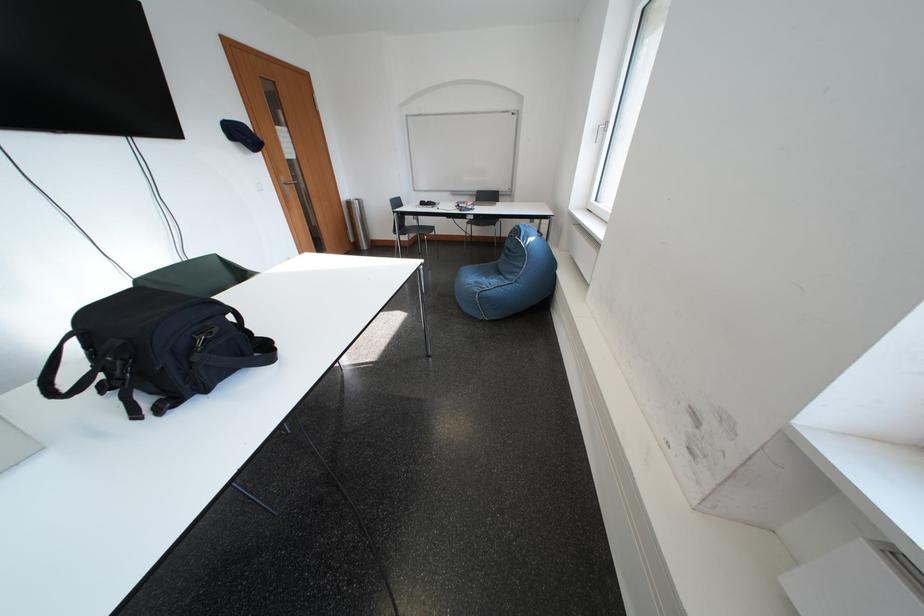
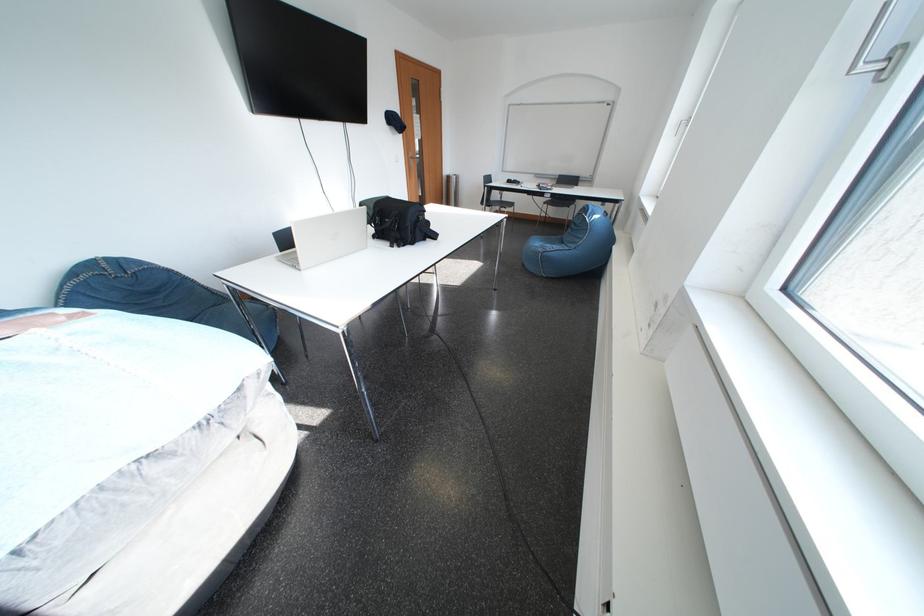
Question: The first image is from the beginning of the video and the second image is from the end. How did the camera likely rotate when shooting the video?

Choices:
 (A) Left
 (B) Right
 (C) Up
 (D) Down

Answer: (A)